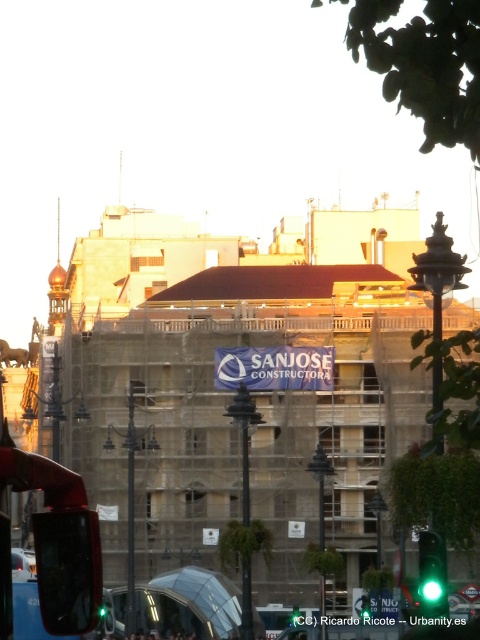
You are standing at point (60, 541) in the construction site image. What object is located exactly at this point?

The shiny red bus at lower left is located exactly at point (60, 541).

You are a delivery driver who needs to park your truck near the shiny red bus at lower left. What are the coordinates where you should park your truck?

The coordinates for the shiny red bus at lower left are at point (60, 541). You should park your truck near those coordinates.

You are a city planner evaluating the space between the shiny red bus at lower left and the green glass traffic light at lower right. If you need to place a new bench that requires 3 meters of space, can the bench fit between them?

The shiny red bus at lower left is wider than the green glass traffic light at lower right, but the exact distance between them isn